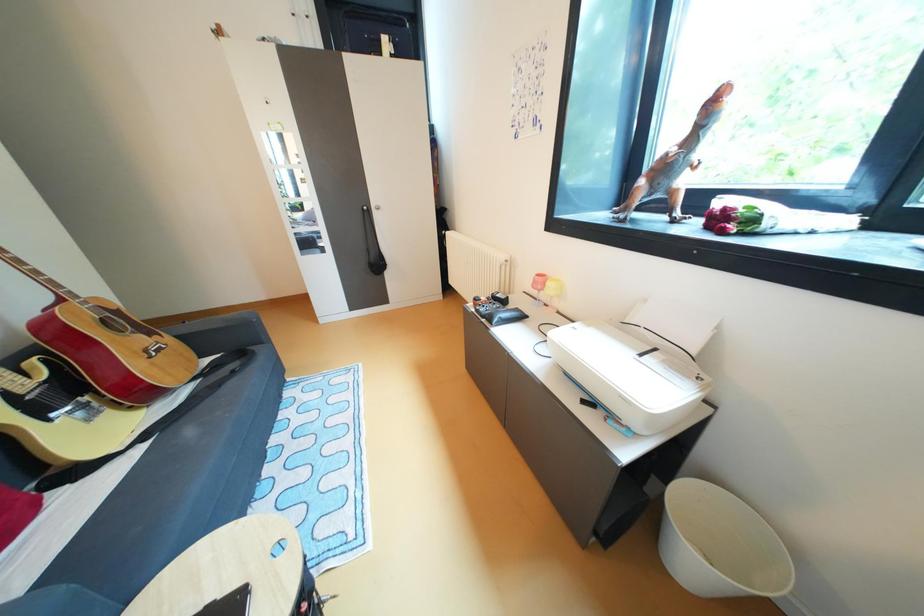
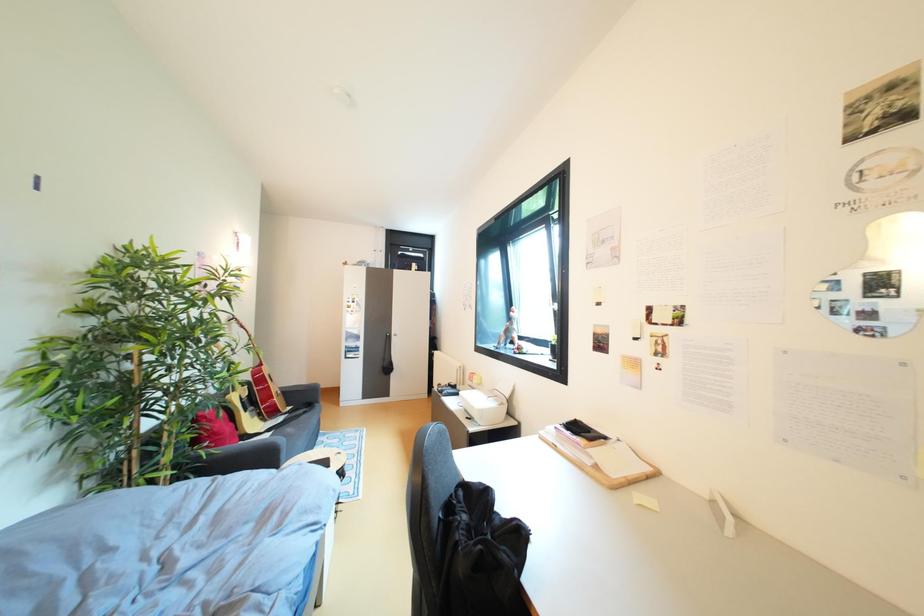
Question: What movement of the cameraman would produce the second image?

Choices:
 (A) Left
 (B) Right
 (C) Forward
 (D) Backward

Answer: (D)